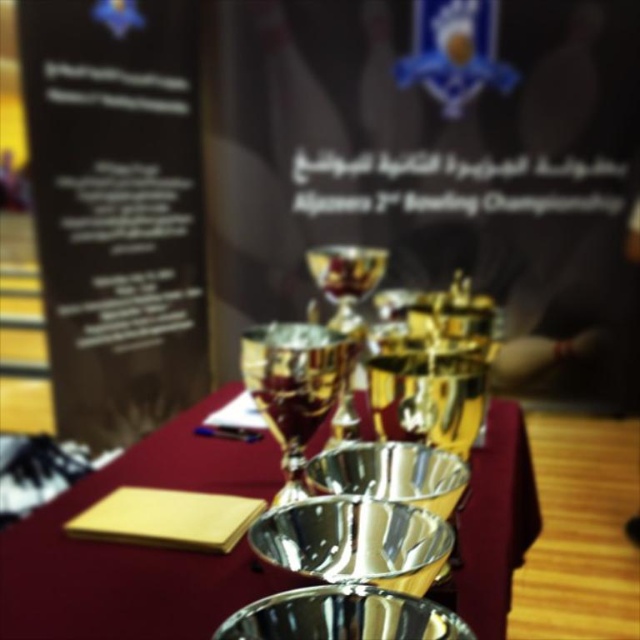
You are organizing a trophy display and notice the black paper at left and the silver metallic bowls at center. Which object should you place first if you want to arrange items from largest to smallest?

The black paper at left should be placed first because it is larger than the silver metallic bowls at center.

Based on the photo, you are organizing a trophy display and need to place the black paper at left and the silver metallic bowls at center on a shelf. If the shelf has limited height, which object might not fit due to its height?

The black paper at left is much taller than the silver metallic bowls at center, so it might not fit on the shelf with limited height.